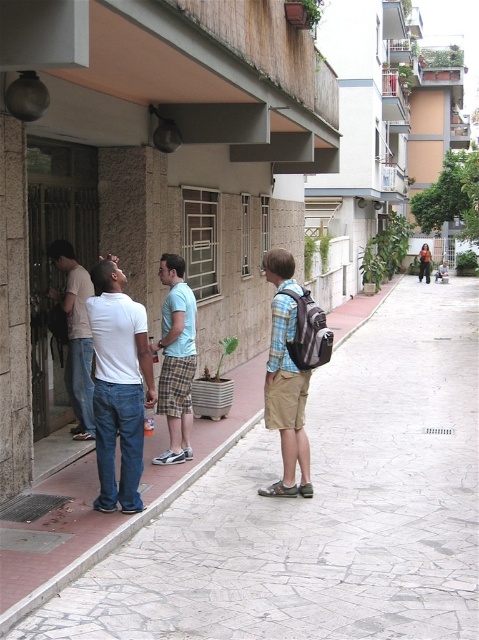
Can you confirm if gray stone pavement at lower left is thinner than white matte shirt at center?

No, gray stone pavement at lower left is not thinner than white matte shirt at center.

Can you confirm if gray stone pavement at lower left is taller than white matte shirt at center?

In fact, gray stone pavement at lower left may be shorter than white matte shirt at center.

The image size is (479, 640). Find the location of `gray stone pavement at lower left`. gray stone pavement at lower left is located at coordinates (321, 508).

Does point (317, 481) come farther from viewer compared to point (191, 452)?

No, it is not.

Is gray stone pavement at lower left in front of light blue plaid shorts at center?

Yes.

Is point (111, 620) less distant than point (160, 266)?

That is True.

Where is `gray stone pavement at lower left`? The width and height of the screenshot is (479, 640). gray stone pavement at lower left is located at coordinates (321, 508).

Does gray stone pavement at lower left appear on the left side of matte white shirt at left?

No, gray stone pavement at lower left is not to the left of matte white shirt at left.

Does gray stone pavement at lower left have a larger size compared to matte white shirt at left?

Yes, gray stone pavement at lower left is bigger than matte white shirt at left.

Locate an element on the screen. This screenshot has width=479, height=640. gray stone pavement at lower left is located at coordinates [x=321, y=508].

Where is `gray stone pavement at lower left`? Image resolution: width=479 pixels, height=640 pixels. gray stone pavement at lower left is located at coordinates (321, 508).